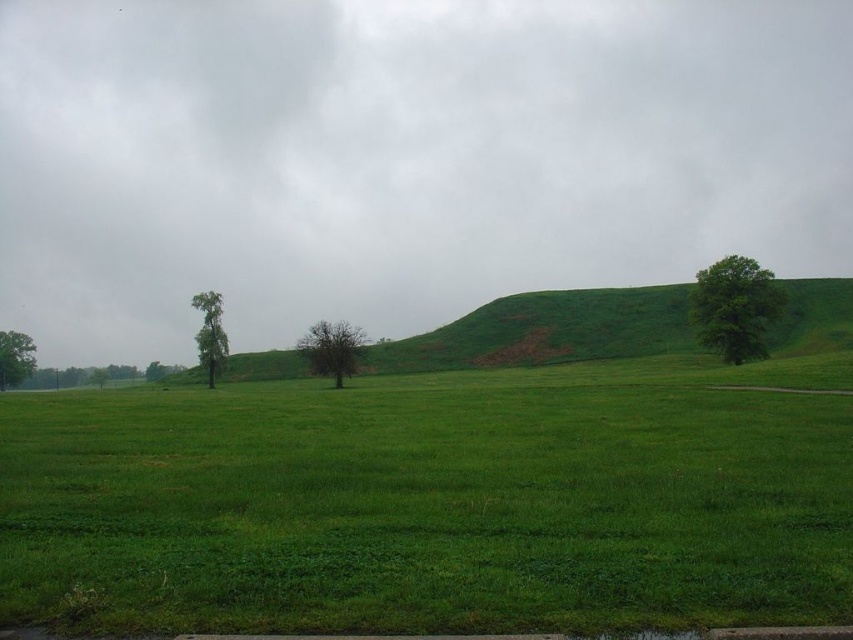
Who is higher up, green grassy field at center or green leafy tree at lower left?

green grassy field at center is above.

You are a GUI agent. You are given a task and a screenshot of the screen. Output one action in this format:
    pyautogui.click(x=<x>, y=<y>)
    Task: Click on the green grassy field at center
    
    Given the screenshot: What is the action you would take?
    (436, 500)

Is green grassy hillside at center thinner than green leafy tree at right?

Incorrect, green grassy hillside at center's width is not less than green leafy tree at right's.

Is point (490, 310) closer to camera compared to point (734, 364)?

That is False.

In order to click on green grassy hillside at center in this screenshot , I will do `click(547, 332)`.

Between green grassy hillside at center and green leafy tree at left, which one appears on the left side from the viewer's perspective?

green leafy tree at left

Which is in front, point (799, 333) or point (219, 312)?

Point (219, 312) is more forward.

This screenshot has height=640, width=853. Identify the location of green grassy hillside at center. (547, 332).

You are a GUI agent. You are given a task and a screenshot of the screen. Output one action in this format:
    pyautogui.click(x=<x>, y=<y>)
    Task: Click on the green grassy hillside at center
    
    Given the screenshot: What is the action you would take?
    pyautogui.click(x=547, y=332)